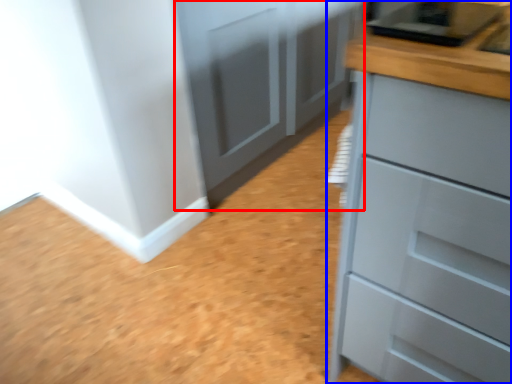
Question: Which object appears closest to the camera in this image, cupboard (highlighted by a red box) or chest of drawers (highlighted by a blue box)?

Choices:
 (A) cupboard
 (B) chest of drawers

Answer: (B)